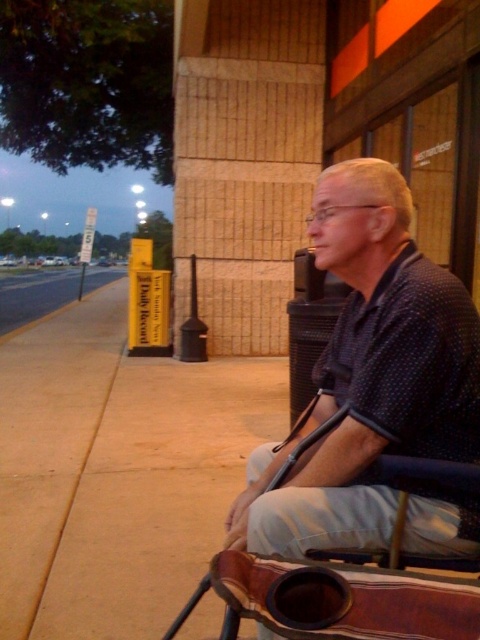
Based on the scene description, what is the 2D coordinate of the polka dot shirt at center?

The 2D coordinate of the polka dot shirt at center is at point (x=369, y=374).

You are a pedestrian approaching the scene from the front. You see the polka dot shirt at center and the paved asphalt at left. Which object is nearer to you?

The polka dot shirt at center is closer to the viewer than the paved asphalt at left.

You are a delivery person needing to place a small package on either the polka dot shirt at center or the paved asphalt at left. Which surface can accommodate the package without it being too small?

The paved asphalt at left can accommodate the package since the polka dot shirt at center is smaller in size and might not provide enough space.